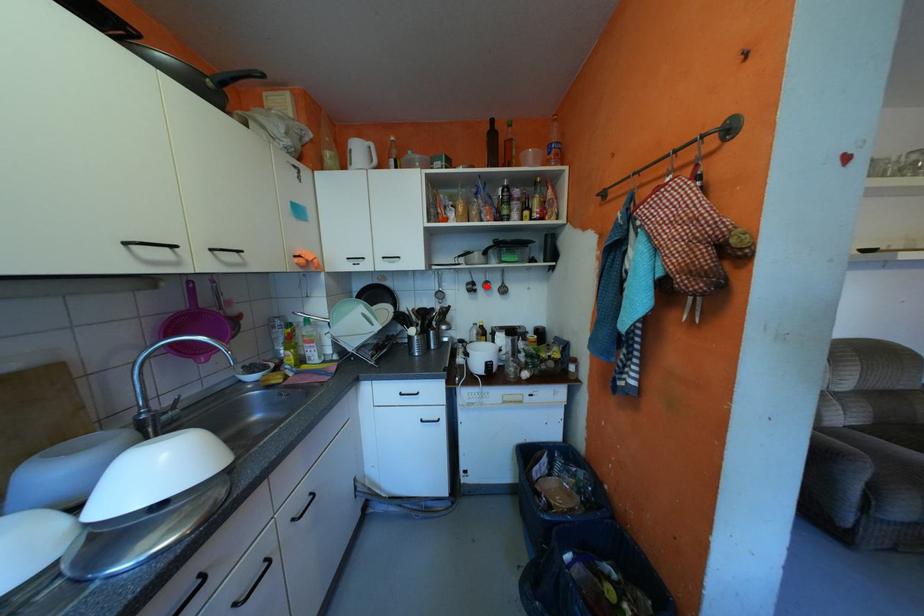
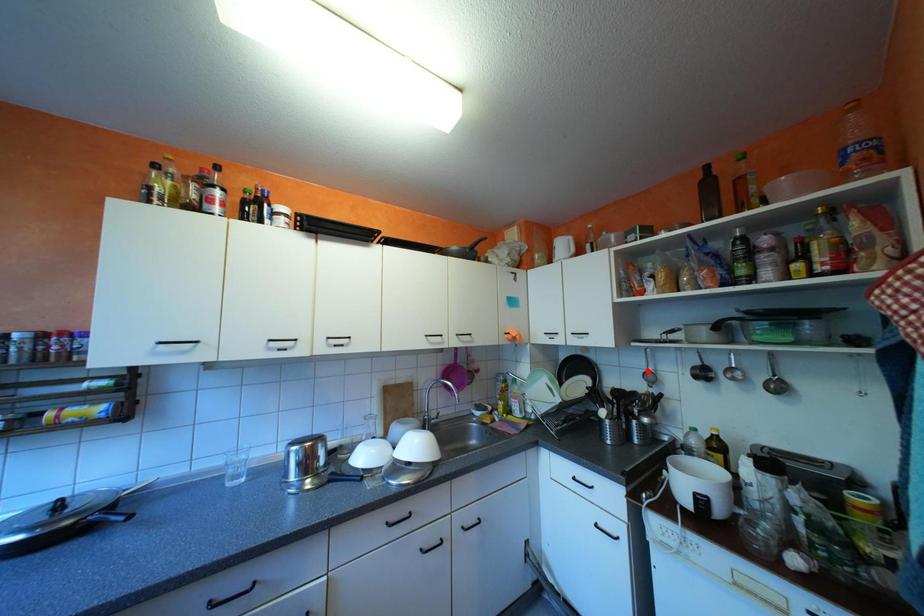
I am providing you with two images of the same scene from different viewpoints. A red point is marked on the first image and another point is marked on the second image. Does the point marked in image1 correspond to the same location as the one in image2?

No